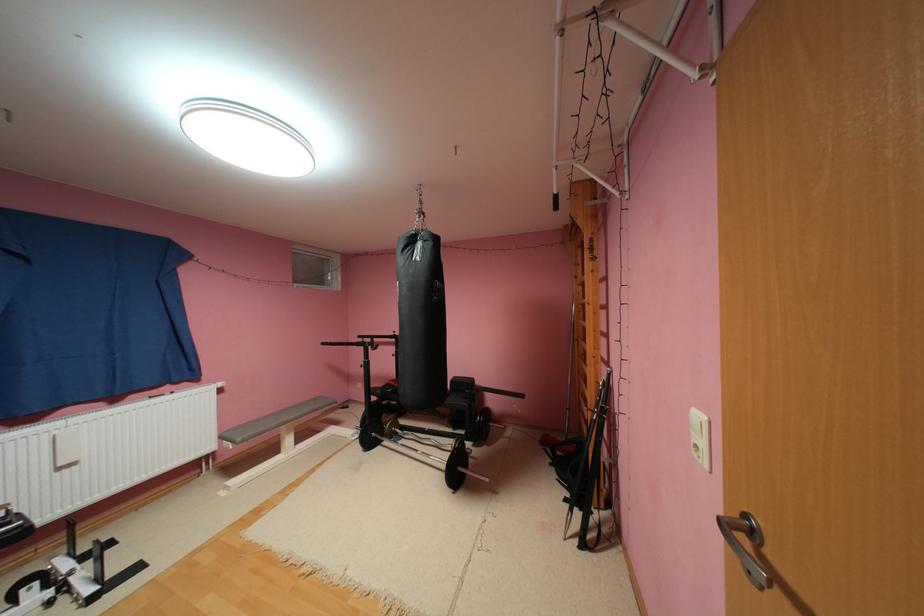
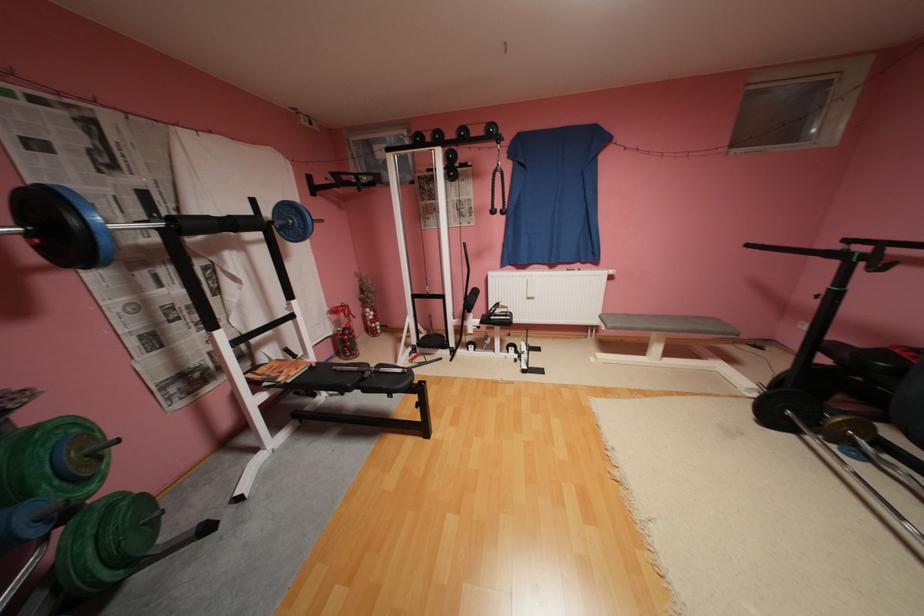
Looking at this image, the first image is from the beginning of the video and the second image is from the end. How did the camera likely rotate when shooting the video?

The camera rotated toward left-down.